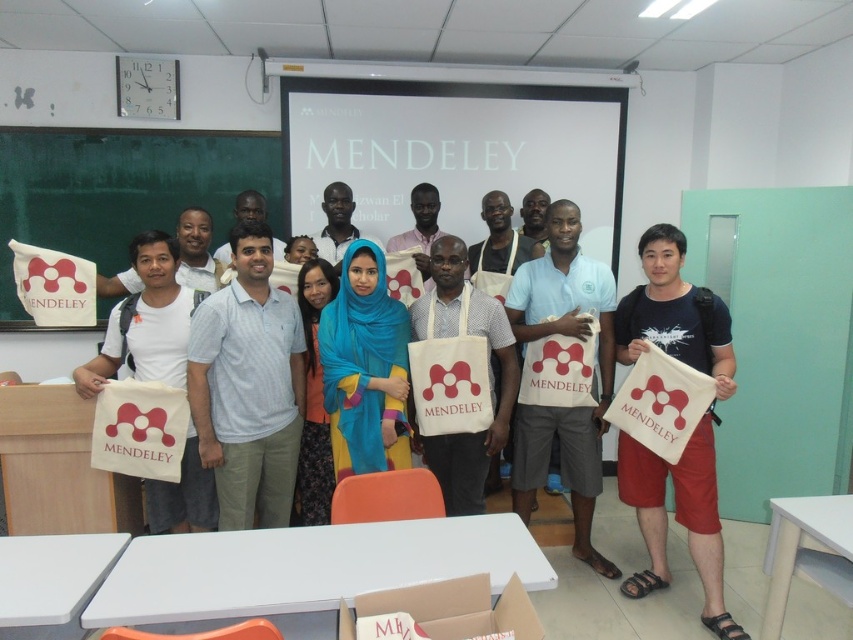
You are an attendee at the Mendeley event and need to find the clock. You see the green chalkboard at left and the white canvas bag at center. Which object is closer to the clock?

The green chalkboard at left is closer to the clock because it is not as tall as the white canvas bag at center, meaning the chalkboard is positioned lower, likely placing it nearer to the clock mounted above the chalkboard.

You are a participant in the Mendeley event and need to locate the clock mentioned in the scene. The clock is positioned relative to the green chalkboard at left and the matte white bag at center. Which object is the clock closer to?

The clock is closer to the green chalkboard at left because it is mounted above the chalkboard, while the matte white bag at center is positioned below the chalkboard. Since the chalkboard is above the bag, the clock, being above the chalkboard, is farther from the bag and closer to the chalkboard.